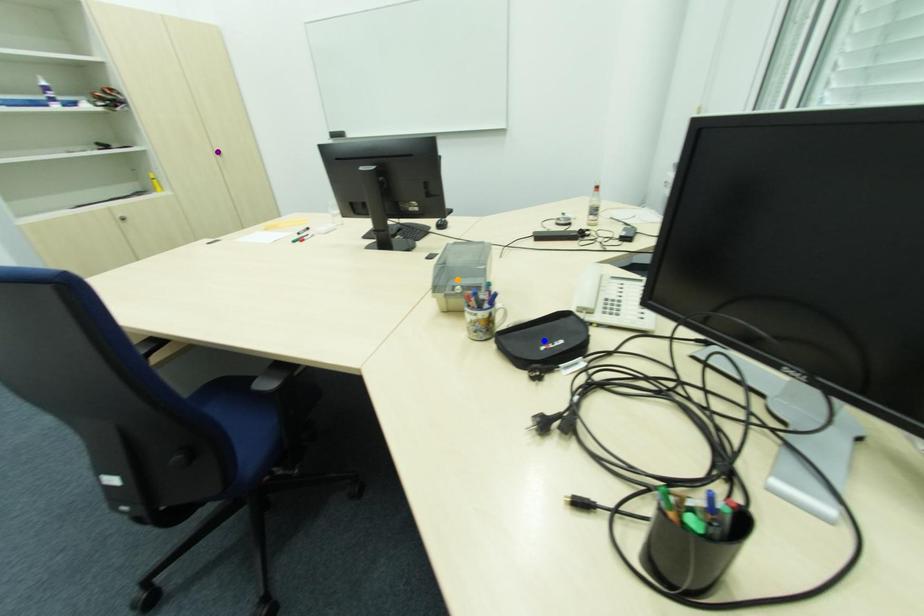
Order these from nearest to farthest:
1. purple point
2. blue point
3. orange point

blue point, orange point, purple point